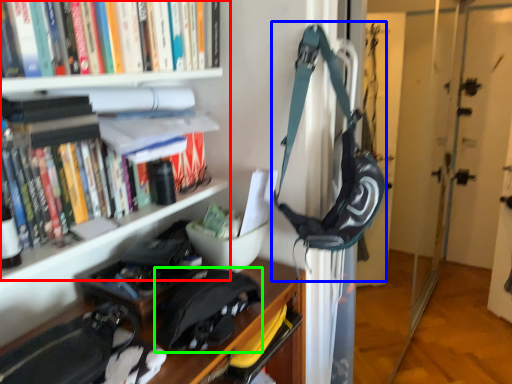
Question: Based on their relative distances, which object is farther from bookcase (highlighted by a red box)? Choose from shoulder bag (highlighted by a blue box) and messenger bag (highlighted by a green box).

Choices:
 (A) shoulder bag
 (B) messenger bag

Answer: (B)